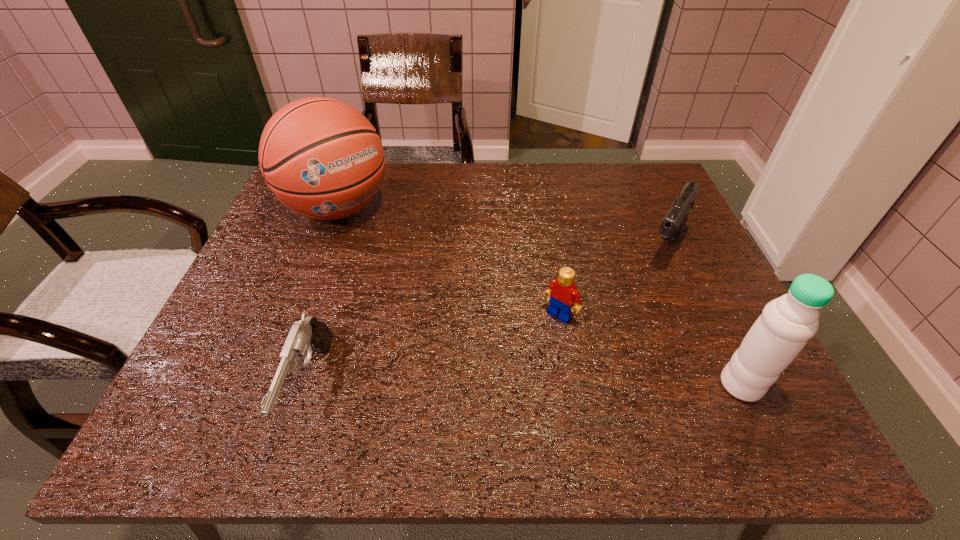
This screenshot has height=540, width=960. Find the location of `water bottle situated at the right edge`. water bottle situated at the right edge is located at coordinates (786, 324).

Identify the location of pistol that is at the right edge. The image size is (960, 540). (672, 225).

This screenshot has height=540, width=960. Find the location of `object at the far left corner`. object at the far left corner is located at coordinates (320, 157).

Where is `object that is positioned at the near right corner`? The image size is (960, 540). object that is positioned at the near right corner is located at coordinates (786, 324).

Locate an element on the screen. Image resolution: width=960 pixels, height=540 pixels. free space at the far edge of the desktop is located at coordinates (549, 191).

Locate an element on the screen. This screenshot has height=540, width=960. vacant area at the near edge is located at coordinates (382, 364).

The width and height of the screenshot is (960, 540). I want to click on free spot at the left edge of the desktop, so click(x=259, y=255).

Identify the location of vacant position at the right edge of the desktop. This screenshot has width=960, height=540. (630, 216).

In the image, there is a desktop. Identify the location of free space at the near left corner. (240, 362).

In the image, there is a desktop. Where is `free space at the near right corner`? The height and width of the screenshot is (540, 960). free space at the near right corner is located at coordinates (690, 359).